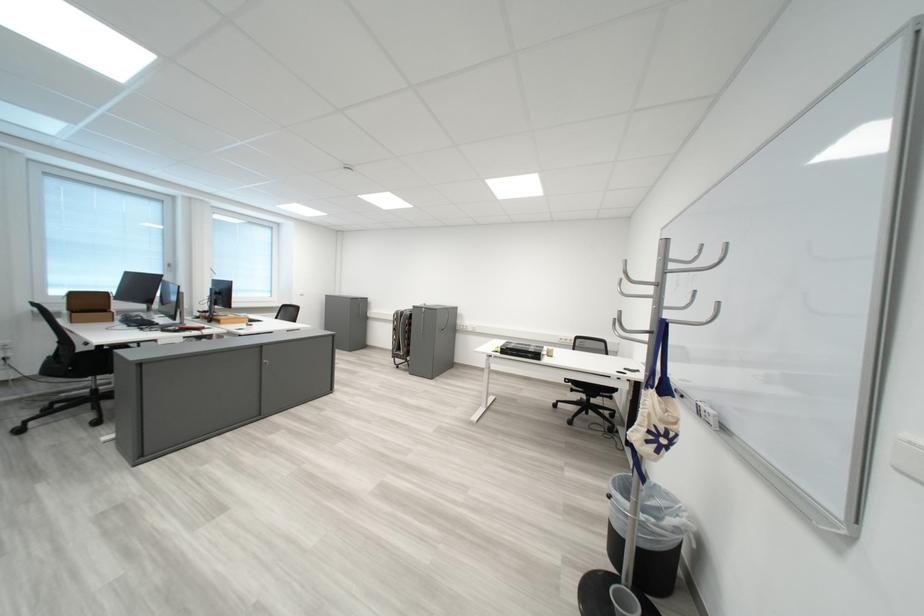
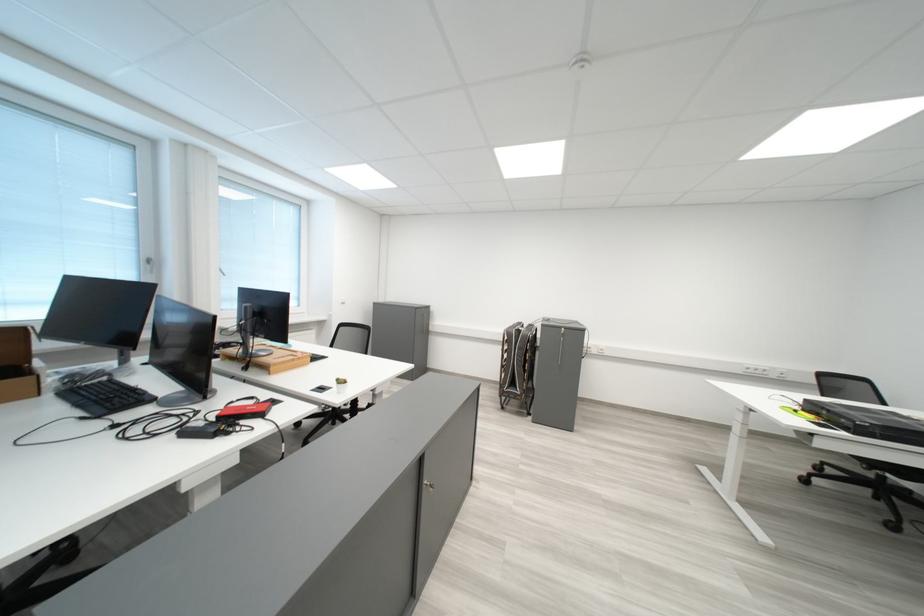
Find the pixel in the second image that matches [232,323] in the first image.

(277, 369)